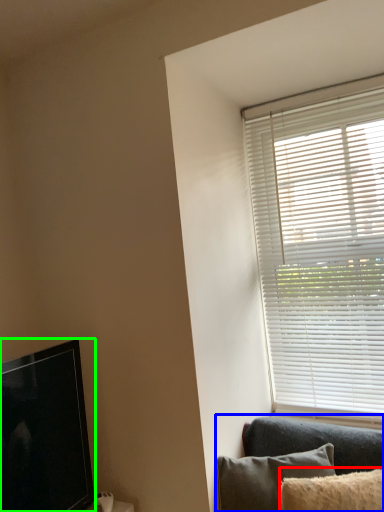
Question: Which object is positioned closest to pillow (highlighted by a red box)? Select from studio couch (highlighted by a blue box) and television (highlighted by a green box).

Choices:
 (A) studio couch
 (B) television

Answer: (A)